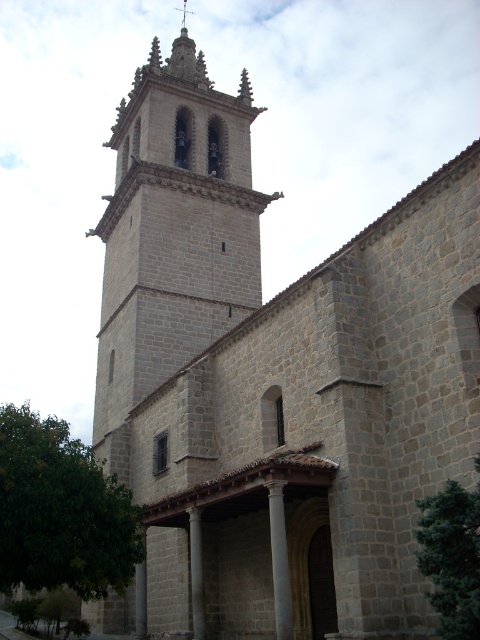
Question: Which point is farther from the camera taking this photo?

Choices:
 (A) (168, 109)
 (B) (200, 516)

Answer: (A)

Question: Can you confirm if gray stone pillar at center is smaller than gray stone pillar at lower center?

Choices:
 (A) yes
 (B) no

Answer: (A)

Question: Among these objects, which one is nearest to the camera?

Choices:
 (A) smooth stone spire at upper center
 (B) gray stone tower at center
 (C) gray stone pillar at center
 (D) gray stone pillar at lower center

Answer: (D)

Question: Based on their relative distances, which object is farther from the gray stone pillar at lower center?

Choices:
 (A) gray stone pillar at center
 (B) smooth stone spire at upper center
 (C) gray stone column at center
 (D) gray stone tower at center

Answer: (B)

Question: Is gray stone column at center positioned behind gray stone pillar at center?

Choices:
 (A) no
 (B) yes

Answer: (A)

Question: In this image, where is gray stone column at center located relative to gray stone pillar at center?

Choices:
 (A) left
 (B) right

Answer: (B)